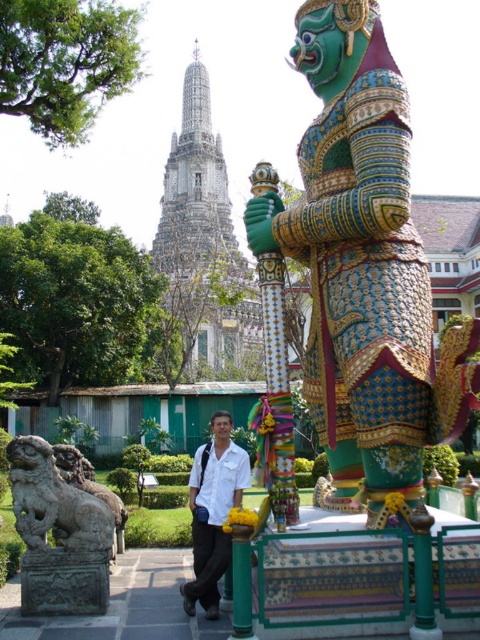
You are standing in front of the temple complex and want to take a photo that includes both the central statue and the distant temple structure. You notice two points marked in the scene. Which point is closer to you, point [425,344] or point [55,477]?

Point [425,344] is closer to the viewer than point [55,477].

You are a tourist visiting the temple complex and want to take a photo of the white stone temple at upper center without the gray stone lion at lower left appearing in the frame. Is this possible given their positions?

The gray stone lion at lower left is behind the white stone temple at upper center, so if you position yourself so that the temple is between you and the lion, you can take a photo of the white stone temple at upper center without the gray stone lion at lower left in the frame.

You are a tourist visiting the temple and want to take a photo of the gray stone lion at lower left and the white matte shirt at center. Which object is narrower when viewed from your position?

The gray stone lion at lower left is thinner than the white matte shirt at center, so it is narrower when viewed from your position.